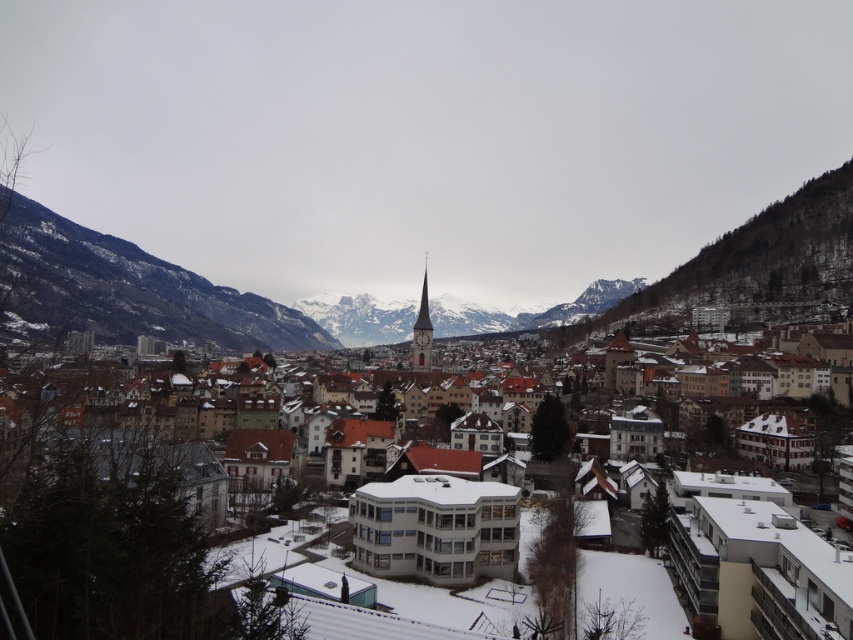
Based on the photo, you are an architect analyzing the town layout. Based on the scene, which object is larger in size between the white matte building at center and the rocky brown mountain at left?

The rocky brown mountain at left is larger than the white matte building at center.

You are an architect planning to install a new antenna on the white matte building at center and the rocky brown mountain at left. Considering their widths, which structure would require a wider base for stability?

The rocky brown mountain at left requires a wider base for stability because it is wider than the white matte building at center.